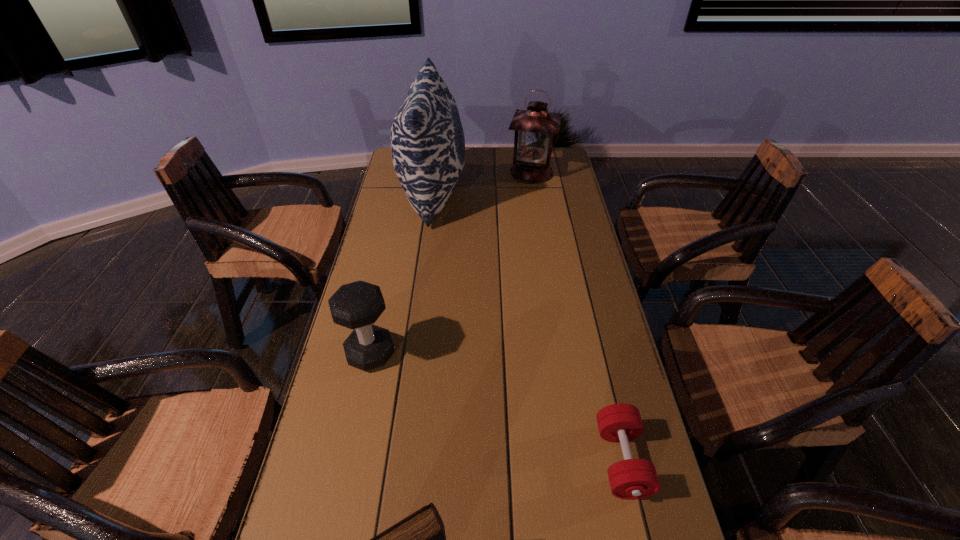
The height and width of the screenshot is (540, 960). What are the coordinates of `free spot that satisfies the following two spatial constraints: 1. on the front surface of the tallest object; 2. on the right side of the shorter dumbbell` in the screenshot? It's located at (397, 460).

You are a GUI agent. You are given a task and a screenshot of the screen. Output one action in this format:
    pyautogui.click(x=<x>, y=<y>)
    Task: Click on the free region that satisfies the following two spatial constraints: 1. on the front surface of the shortest object; 2. on the left side of the cushion
    The image size is (960, 540).
    Given the screenshot: What is the action you would take?
    pyautogui.click(x=397, y=460)